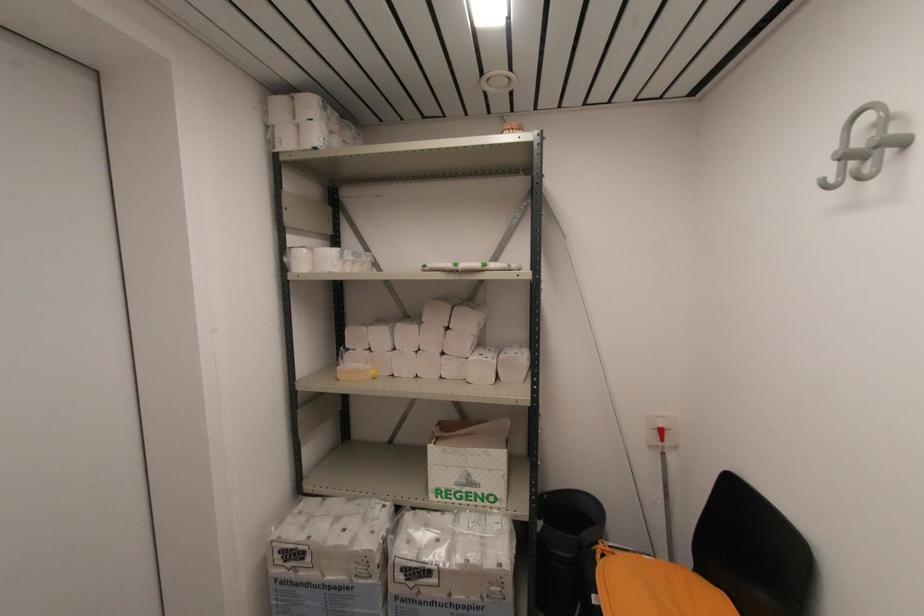
At what (x,y) coordinates should I click in order to perform the action: click on white cardboard box. Please return your answer as a coordinate pair (x, y). The image size is (924, 616). Looking at the image, I should click on (468, 463).